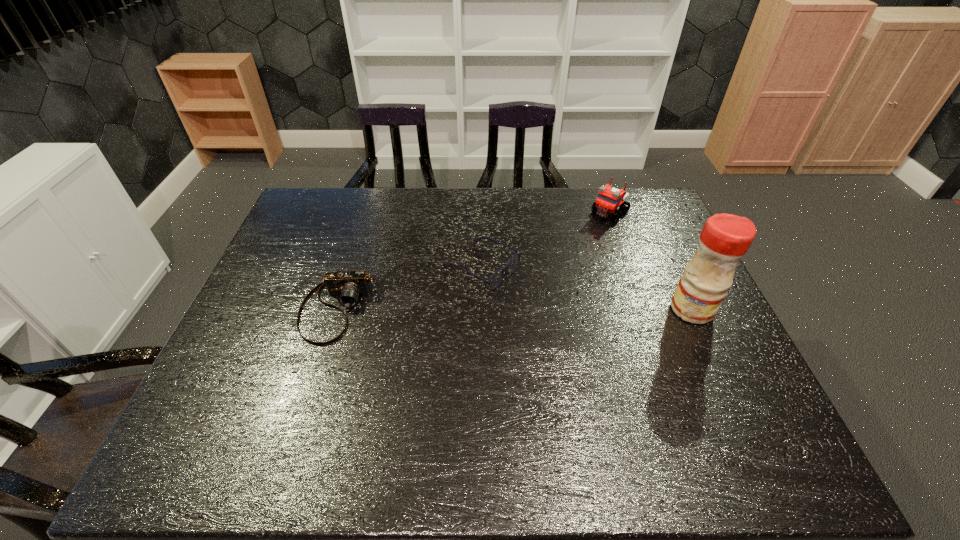
Where is `vacant region between the condiment and the spectacles`? The height and width of the screenshot is (540, 960). vacant region between the condiment and the spectacles is located at coordinates (587, 288).

At what (x,y) coordinates should I click in order to perform the action: click on free space between the condiment and the farthest object. Please return your answer as a coordinate pair (x, y). The width and height of the screenshot is (960, 540). Looking at the image, I should click on (651, 261).

The height and width of the screenshot is (540, 960). Identify the location of empty space between the camera and the rightmost object. (515, 309).

Locate an element on the screen. This screenshot has height=540, width=960. free space between the second tallest object and the shortest object is located at coordinates (545, 239).

The image size is (960, 540). I want to click on vacant point located between the shortest object and the rightmost object, so click(587, 288).

The height and width of the screenshot is (540, 960). What are the coordinates of `vacant area between the leftmost object and the second object from right to left` in the screenshot? It's located at (473, 261).

Locate an element on the screen. The width and height of the screenshot is (960, 540). object that stands as the closest to the second object from left to right is located at coordinates (348, 286).

Where is `object that is the closest to the second object from left to right`? This screenshot has width=960, height=540. object that is the closest to the second object from left to right is located at coordinates (348, 286).

Find the location of `vacant position in the image that satisfies the following two spatial constraints: 1. on the front side of the second tallest object; 2. on the left side of the tallest object`. vacant position in the image that satisfies the following two spatial constraints: 1. on the front side of the second tallest object; 2. on the left side of the tallest object is located at coordinates (645, 309).

Where is `vacant area that satisfies the following two spatial constraints: 1. on the front side of the Lego; 2. on the right side of the tallest object`? Image resolution: width=960 pixels, height=540 pixels. vacant area that satisfies the following two spatial constraints: 1. on the front side of the Lego; 2. on the right side of the tallest object is located at coordinates (645, 309).